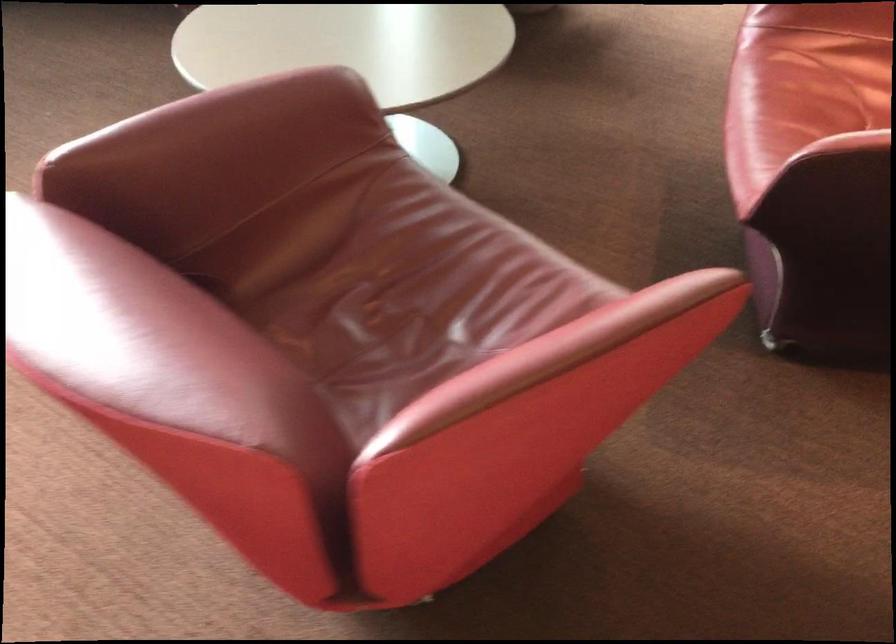
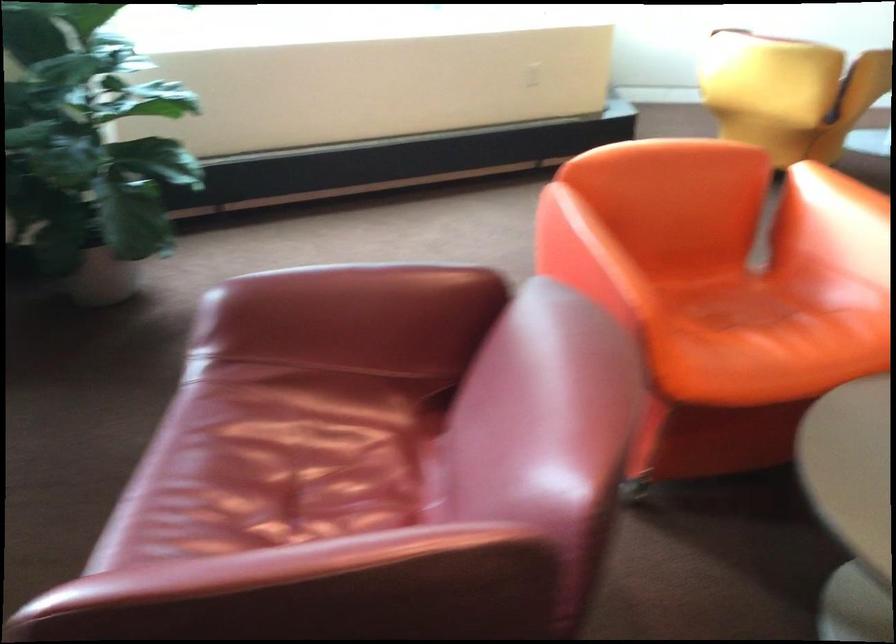
Question: The images are taken continuously from a first-person perspective. In which direction is your viewpoint rotating?

Choices:
 (A) Left
 (B) Right
 (C) Up
 (D) Down

Answer: (C)